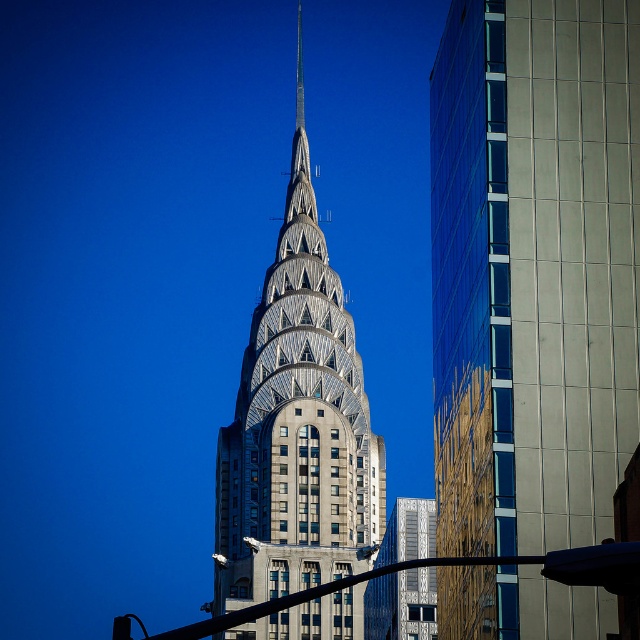
You are standing at the base of the Chrysler Building and want to take a photo that includes both the Chrysler Building and the reflective glass skyscraper at center. Based on their positions, which building should you position to your left to capture both in the frame?

The reflective glass skyscraper at center is located at point (532, 269), so you should position the Chrysler Building to your left since it is closer to the left side of the image, allowing both buildings to be captured in the frame.